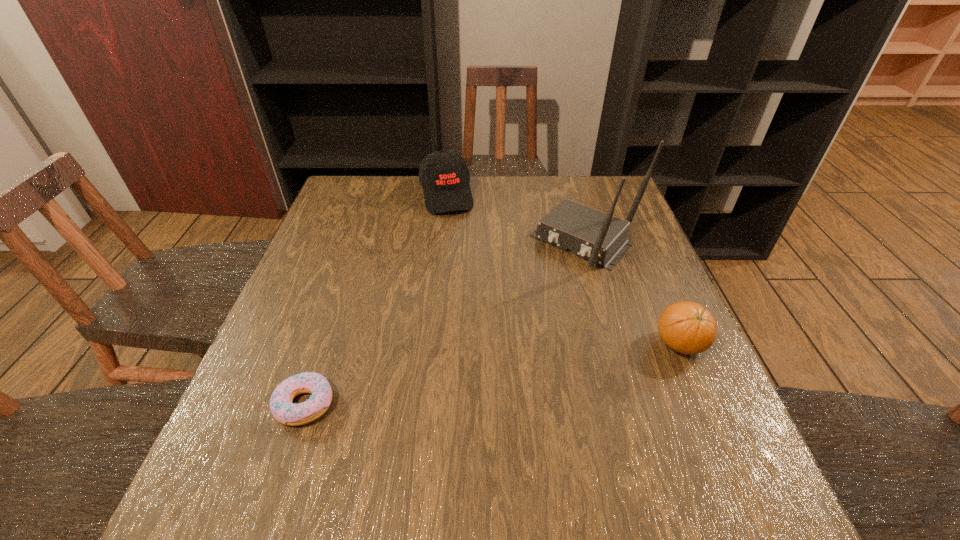
Where is `vacant point located on the back of the router to connect cables`? The height and width of the screenshot is (540, 960). vacant point located on the back of the router to connect cables is located at coordinates (539, 289).

This screenshot has width=960, height=540. Find the location of `vacant space situated 0.050m on the front-facing side of the third object from right to left`. vacant space situated 0.050m on the front-facing side of the third object from right to left is located at coordinates (453, 226).

Find the location of a particular element. The image size is (960, 540). vacant space located on the front-facing side of the third object from right to left is located at coordinates 468,279.

Where is `vacant space located 0.220m on the front-facing side of the third object from right to left`? vacant space located 0.220m on the front-facing side of the third object from right to left is located at coordinates (464, 264).

Where is `router present at the far edge`? The width and height of the screenshot is (960, 540). router present at the far edge is located at coordinates (601, 238).

Identify the location of baseball cap located in the far edge section of the desktop. (444, 175).

This screenshot has height=540, width=960. I want to click on object that is at the near edge, so click(x=283, y=410).

The image size is (960, 540). What are the coordinates of `object that is at the left edge` in the screenshot? It's located at (283, 410).

The image size is (960, 540). I want to click on orange located in the right edge section of the desktop, so click(x=686, y=327).

Identify the location of router at the right edge. The width and height of the screenshot is (960, 540). (601, 238).